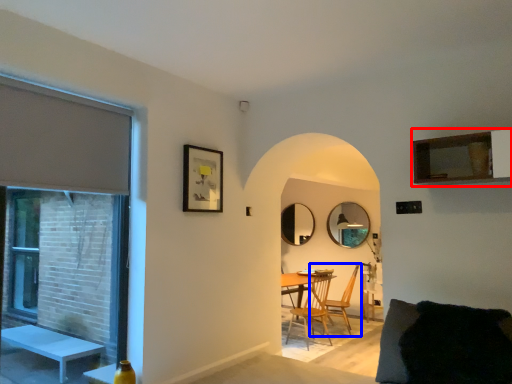
Question: Which object appears farthest to the camera in this image, cabinetry (highlighted by a red box) or chair (highlighted by a blue box)?

Choices:
 (A) cabinetry
 (B) chair

Answer: (B)